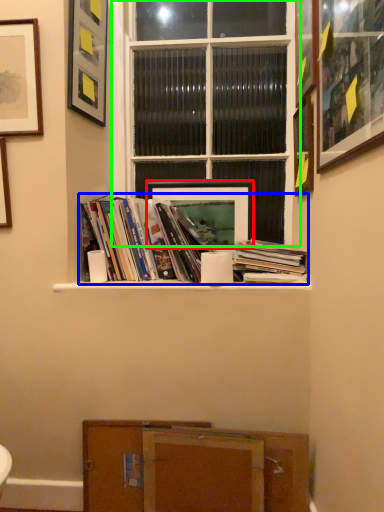
Question: Estimate the real-world distances between objects in this image. Which object is farther from picture frame (highlighted by a red box), book (highlighted by a blue box) or window (highlighted by a green box)?

Choices:
 (A) book
 (B) window

Answer: (B)